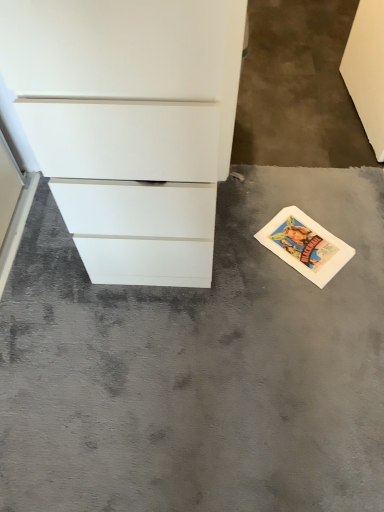
You are a GUI agent. You are given a task and a screenshot of the screen. Output one action in this format:
    pyautogui.click(x=<x>, y=<y>)
    Task: Click on the free space between white matte chest of drawers at left and white paper postcard at lower right
    
    Given the screenshot: What is the action you would take?
    coord(252,240)